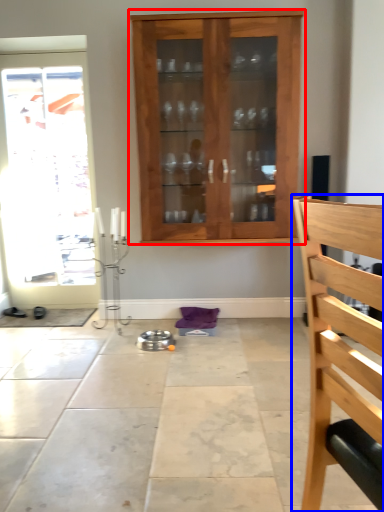
Question: Which of the following is the closest to the observer, cabinetry (highlighted by a red box) or chair (highlighted by a blue box)?

Choices:
 (A) cabinetry
 (B) chair

Answer: (B)